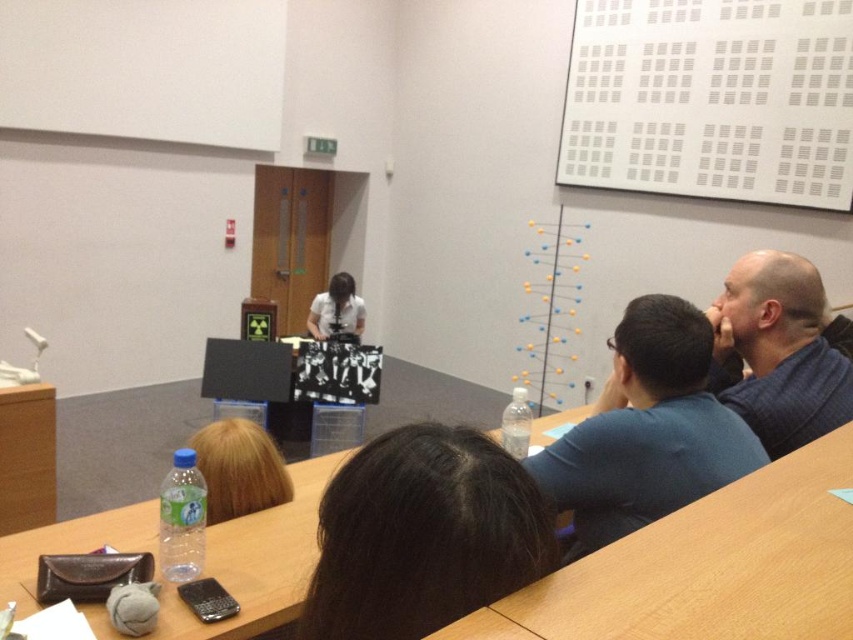
Question: Where is blonde hair at center located in relation to matte white shirt at center in the image?

Choices:
 (A) above
 (B) below

Answer: (B)

Question: Which object is the farthest from the blonde hair at center?

Choices:
 (A) blue shirt at right
 (B) wooden table at lower center
 (C) white matte board at upper center

Answer: (C)

Question: Can you confirm if dark brown hair at center is positioned to the left of dark blue sweater at right?

Choices:
 (A) yes
 (B) no

Answer: (A)

Question: In this image, where is dark brown hair at center located relative to blonde hair at center?

Choices:
 (A) below
 (B) above

Answer: (B)

Question: Which point is farther to the camera?

Choices:
 (A) (585, 426)
 (B) (131, 525)

Answer: (B)

Question: Which of these objects is positioned farthest from the dark brown hair at center?

Choices:
 (A) matte white shirt at center
 (B) blue shirt at right
 (C) white matte board at upper center

Answer: (A)